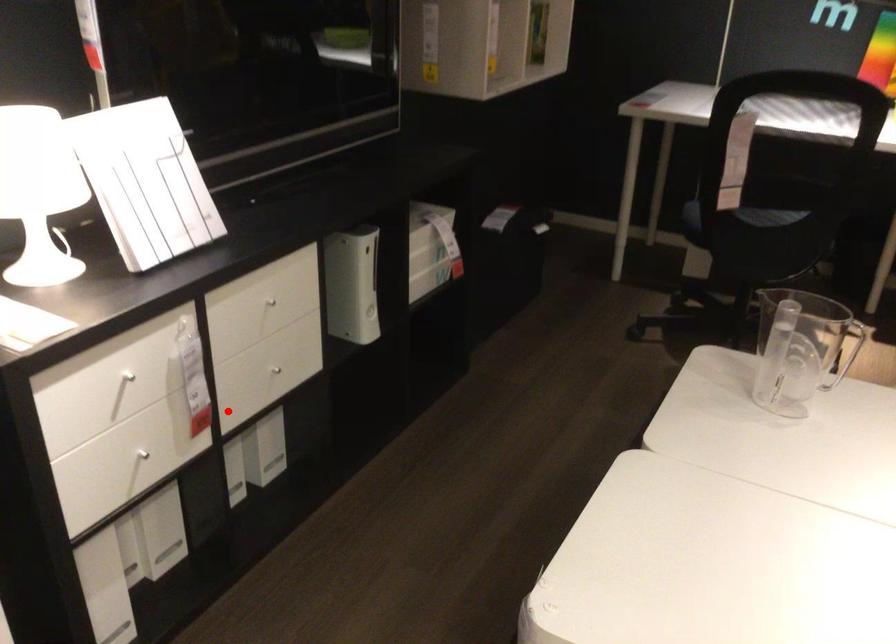
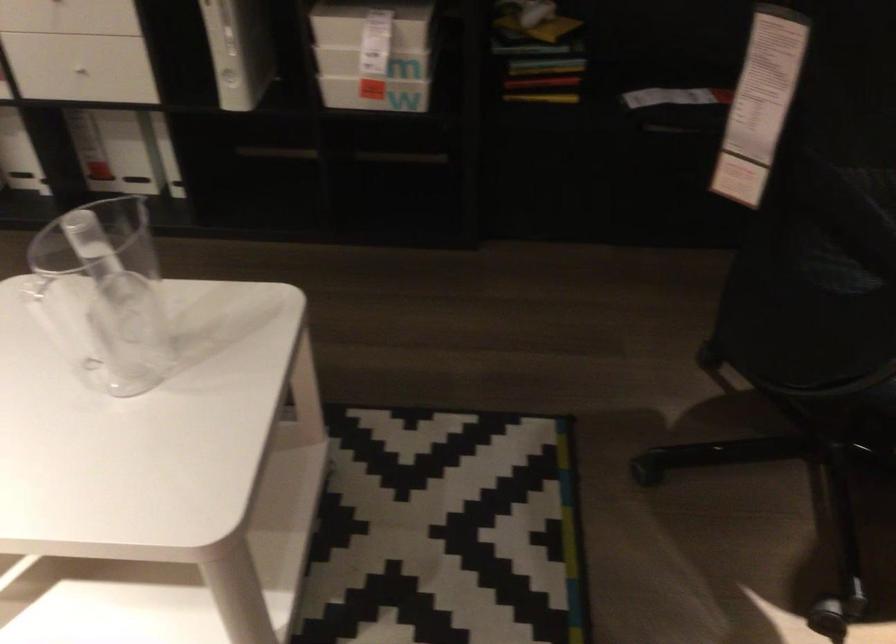
Question: A red point is marked in image1. In image2, is the corresponding 3D point closer to the camera or farther? Reply with the corresponding letter.

Choices:
 (A) The corresponding 3D point is closer.
 (B) The corresponding 3D point is farther.

Answer: (B)